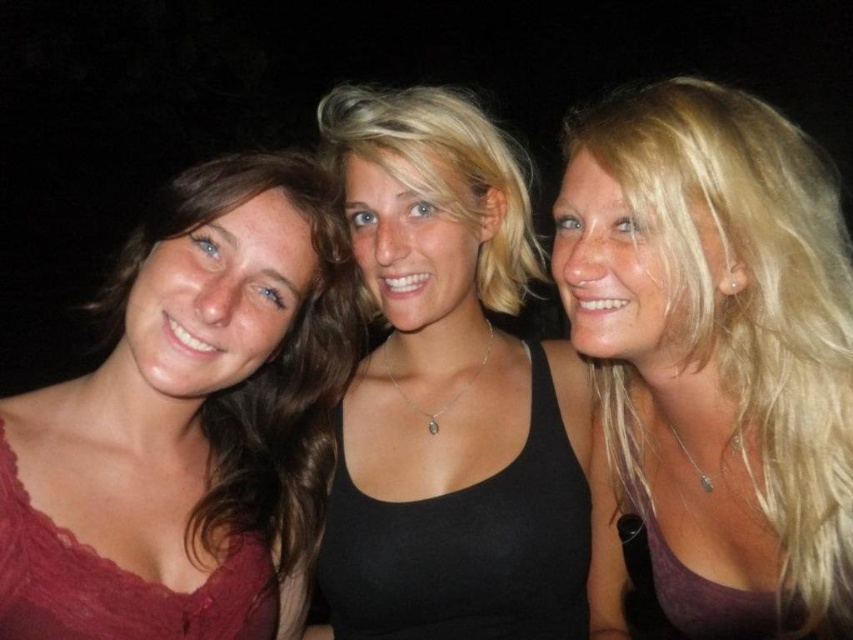
Does black matte tank top at center appear under matte red dress at left?

No.

Find the location of a particular element. The width and height of the screenshot is (853, 640). black matte tank top at center is located at coordinates (450, 392).

The image size is (853, 640). What do you see at coordinates (712, 356) in the screenshot?
I see `blonde hair at center` at bounding box center [712, 356].

Is blonde hair at center thinner than black matte tank top at center?

No, blonde hair at center is not thinner than black matte tank top at center.

Who is more distant from viewer, (698,474) or (558,628)?

Point (558,628)

Identify the location of blonde hair at center. (712, 356).

Can you confirm if blonde hair at center is positioned to the right of matte red dress at left?

Correct, you'll find blonde hair at center to the right of matte red dress at left.

Is point (596, 172) less distant than point (181, 522)?

Yes, it is in front of point (181, 522).

Image resolution: width=853 pixels, height=640 pixels. Describe the element at coordinates (712, 356) in the screenshot. I see `blonde hair at center` at that location.

Where is `blonde hair at center`? blonde hair at center is located at coordinates (712, 356).